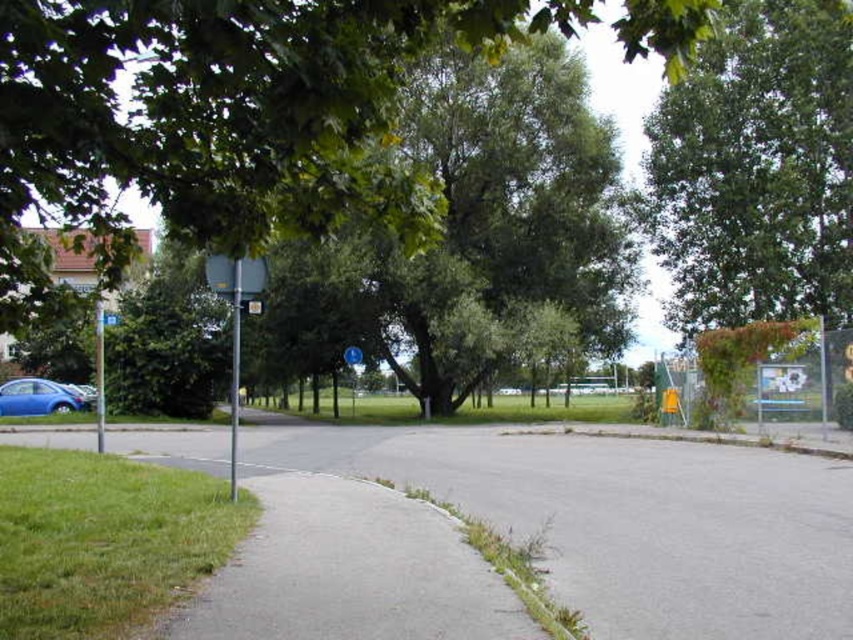
Question: Which point is farther to the camera?

Choices:
 (A) (218, 115)
 (B) (643, 563)
 (C) (827, 88)

Answer: (C)

Question: Does green leafy tree at upper right have a greater width compared to green grass at lower left?

Choices:
 (A) no
 (B) yes

Answer: (B)

Question: Is green leafy tree at upper right to the left of metallic blue sign at center from the viewer's perspective?

Choices:
 (A) yes
 (B) no

Answer: (B)

Question: Which object is farther from the camera taking this photo?

Choices:
 (A) green grass at lower left
 (B) green leafy tree at upper center

Answer: (A)

Question: Which point is farther from the camera taking this photo?

Choices:
 (A) (370, 449)
 (B) (167, 520)
 (C) (234, 285)

Answer: (A)

Question: Is green grass at lower left to the right of metallic pole at left from the viewer's perspective?

Choices:
 (A) no
 (B) yes

Answer: (B)